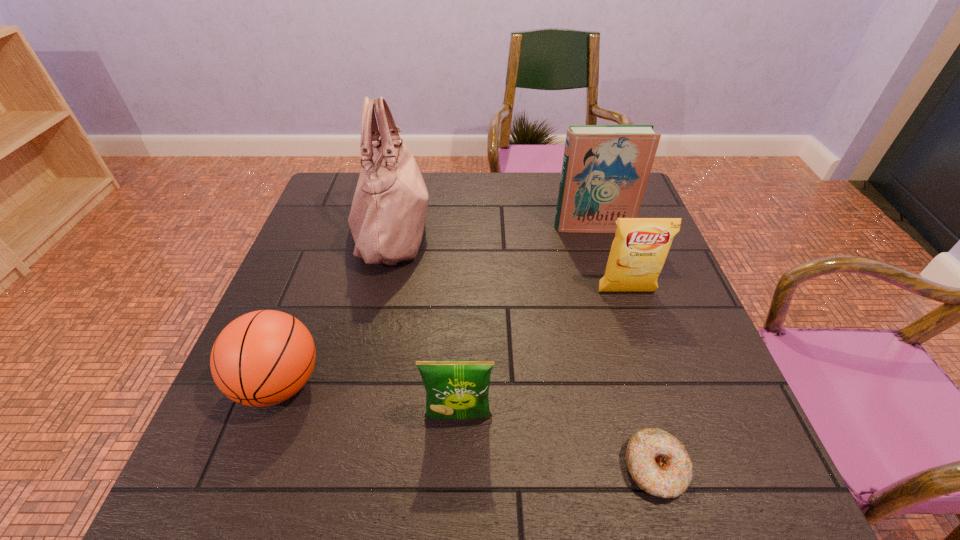
Locate an element on the screen. This screenshot has height=540, width=960. handbag is located at coordinates (388, 213).

This screenshot has height=540, width=960. What are the coordinates of `the fifth shortest object` in the screenshot? It's located at (605, 170).

Where is `the right crisp (potato chip)`? The width and height of the screenshot is (960, 540). the right crisp (potato chip) is located at coordinates (640, 247).

Identify the location of the third tallest object. This screenshot has height=540, width=960. (640, 247).

Image resolution: width=960 pixels, height=540 pixels. I want to click on the nearer crisp (potato chip), so click(458, 389).

Locate an element on the screen. The width and height of the screenshot is (960, 540). the left crisp (potato chip) is located at coordinates (458, 389).

Find the location of `basketball`. basketball is located at coordinates (262, 358).

Find the location of a particular element. The image size is (960, 540). the shortest object is located at coordinates (658, 462).

I want to click on doughnut, so click(x=658, y=462).

Identify the location of vacant space situated at the front of the handbag with handles. The width and height of the screenshot is (960, 540). tap(552, 230).